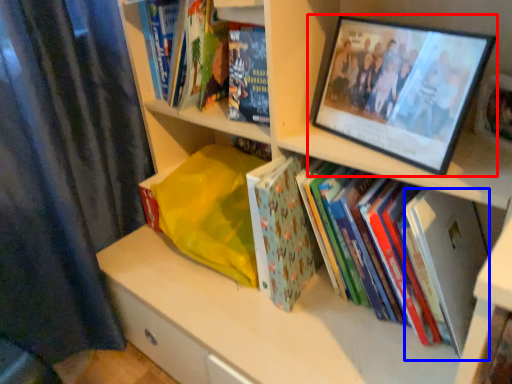
Question: Which object appears closest to the camera in this image, picture frame (highlighted by a red box) or paperback book (highlighted by a blue box)?

Choices:
 (A) picture frame
 (B) paperback book

Answer: (A)